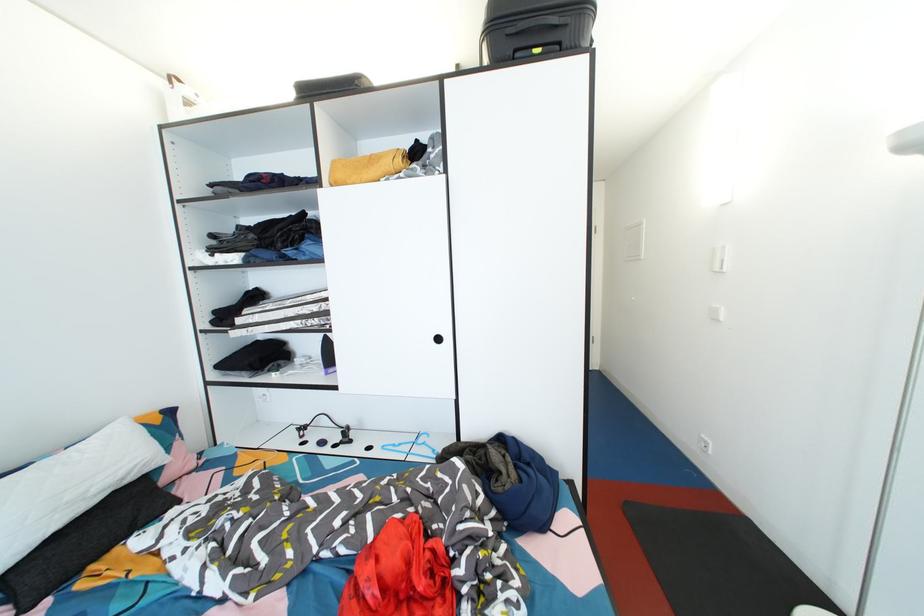
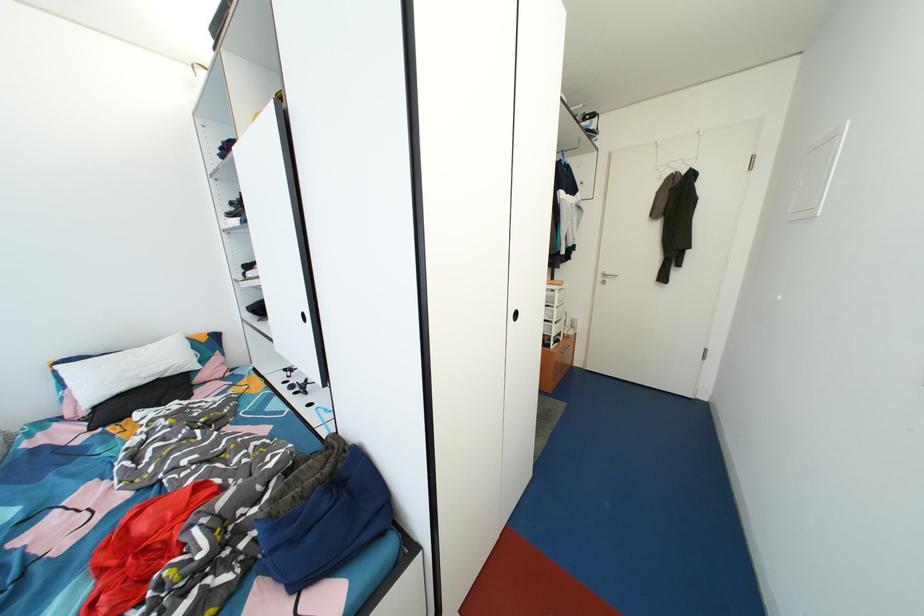
In the second image, find the point that corresponds to [128,477] in the first image.

(167, 373)